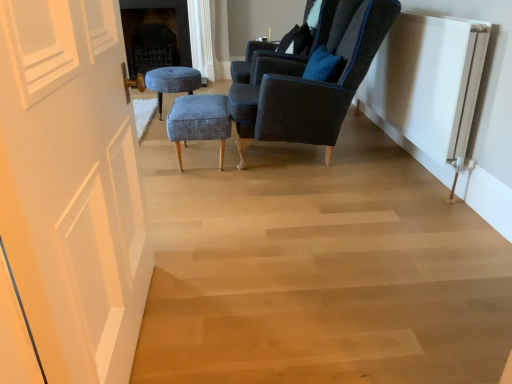
In order to click on free point below velvet dark blue armchair at center, marked as the second chair in a back-to-front arrangement (from a real-world perspective) in this screenshot , I will do `click(307, 162)`.